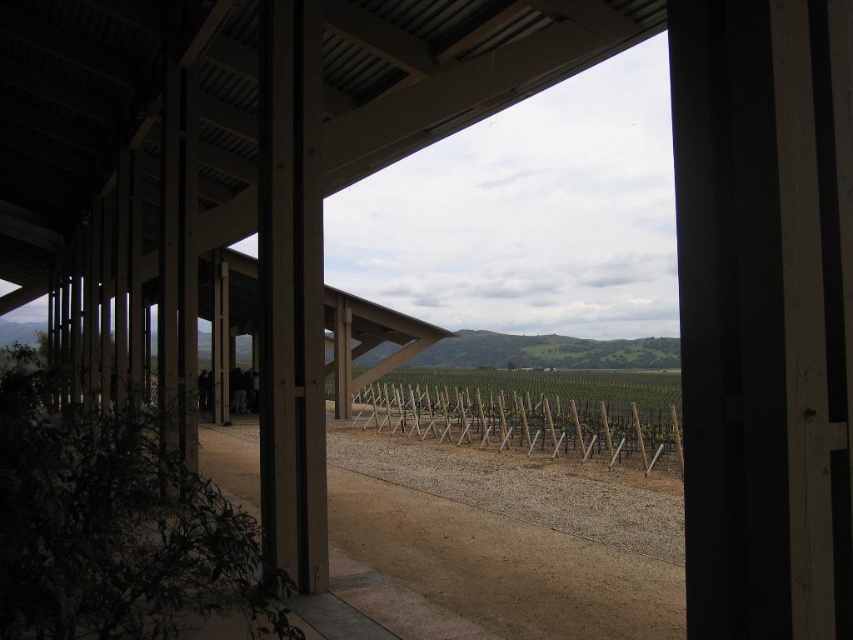
Question: Does smooth wood pillar at center appear on the left side of green wooden fence at center?

Choices:
 (A) no
 (B) yes

Answer: (B)

Question: Can you confirm if smooth wood pillar at center is bigger than green wooden fence at center?

Choices:
 (A) no
 (B) yes

Answer: (A)

Question: Which point appears closest to the camera in this image?

Choices:
 (A) (274, 161)
 (B) (653, 444)

Answer: (A)

Question: Is smooth wood pillar at center thinner than green wooden fence at center?

Choices:
 (A) no
 (B) yes

Answer: (B)